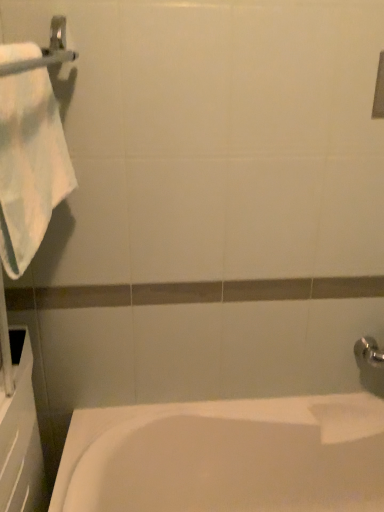
Question: Considering the relative positions of silver metallic towel bar at upper left and white cotton towel at left in the image provided, is silver metallic towel bar at upper left to the left of white cotton towel at left from the viewer's perspective?

Choices:
 (A) yes
 (B) no

Answer: (B)

Question: From the image's perspective, is silver metallic towel bar at upper left above white cotton towel at left?

Choices:
 (A) no
 (B) yes

Answer: (B)

Question: From a real-world perspective, is silver metallic towel bar at upper left under white cotton towel at left?

Choices:
 (A) no
 (B) yes

Answer: (A)

Question: From a real-world perspective, is silver metallic towel bar at upper left positioned over white cotton towel at left based on gravity?

Choices:
 (A) yes
 (B) no

Answer: (A)

Question: Is silver metallic towel bar at upper left positioned in front of white cotton towel at left?

Choices:
 (A) no
 (B) yes

Answer: (B)

Question: Is white cotton towel at left in front of or behind white glossy bathtub at lower left in the image?

Choices:
 (A) front
 (B) behind

Answer: (A)

Question: Do you think white cotton towel at left is within white glossy bathtub at lower left, or outside of it?

Choices:
 (A) outside
 (B) inside

Answer: (A)

Question: Based on their positions, is white cotton towel at left located to the left or right of white glossy bathtub at lower left?

Choices:
 (A) left
 (B) right

Answer: (A)

Question: In terms of size, does white cotton towel at left appear bigger or smaller than white glossy bathtub at lower left?

Choices:
 (A) small
 (B) big

Answer: (A)

Question: Is white cotton towel at left spatially inside silver metallic towel bar at upper left, or outside of it?

Choices:
 (A) outside
 (B) inside

Answer: (A)

Question: Is white cotton towel at left wider or thinner than silver metallic towel bar at upper left?

Choices:
 (A) thin
 (B) wide

Answer: (B)

Question: In the image, is white cotton towel at left on the left side or the right side of silver metallic towel bar at upper left?

Choices:
 (A) right
 (B) left

Answer: (B)

Question: Relative to silver metallic towel bar at upper left, is white cotton towel at left in front or behind?

Choices:
 (A) behind
 (B) front

Answer: (A)

Question: From the image's perspective, relative to silver metallic towel bar at upper left, is white glossy bathtub at lower left above or below?

Choices:
 (A) above
 (B) below

Answer: (B)

Question: Is white glossy bathtub at lower left bigger or smaller than silver metallic towel bar at upper left?

Choices:
 (A) small
 (B) big

Answer: (B)